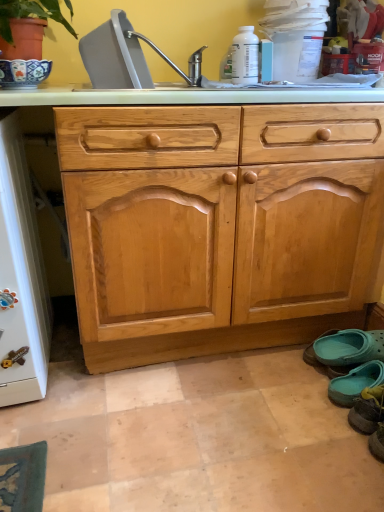
Question: Which direction should I rotate to look at gray plastic sink at upper center, placed as the 2th sink when sorted from back to front, — up or down?

Choices:
 (A) down
 (B) up

Answer: (B)

Question: Can you confirm if white glossy refrigerator at left is smaller than teal fabric slipper at lower right, which is counted as the second footwear, starting from the back?

Choices:
 (A) no
 (B) yes

Answer: (A)

Question: From a real-world perspective, is white glossy refrigerator at left located beneath teal fabric slipper at lower right, the second footwear when ordered from front to back?

Choices:
 (A) yes
 (B) no

Answer: (B)

Question: Does white glossy refrigerator at left have a lesser width compared to teal fabric slipper at lower right, the second footwear when ordered from front to back?

Choices:
 (A) no
 (B) yes

Answer: (A)

Question: Is teal fabric slipper at lower right, the second footwear when ordered from front to back, at the back of white glossy refrigerator at left?

Choices:
 (A) no
 (B) yes

Answer: (A)

Question: Does white glossy refrigerator at left appear on the left side of teal fabric slipper at lower right, which is counted as the second footwear, starting from the back?

Choices:
 (A) no
 (B) yes

Answer: (B)

Question: Is white glossy refrigerator at left taller than teal fabric slipper at lower right, which is counted as the second footwear, starting from the back?

Choices:
 (A) yes
 (B) no

Answer: (A)

Question: Could you tell me if teal fabric slipper at lower right, the second footwear when ordered from front to back, is turned towards teal rubber clogs at lower right, acting as the 1th footwear starting from the back?

Choices:
 (A) yes
 (B) no

Answer: (B)

Question: Is the depth of teal fabric slipper at lower right, the second footwear when ordered from front to back, less than that of teal rubber clogs at lower right, acting as the 1th footwear starting from the back?

Choices:
 (A) no
 (B) yes

Answer: (B)

Question: From the image's perspective, is teal fabric slipper at lower right, the second footwear when ordered from front to back, below teal rubber clogs at lower right, acting as the 1th footwear starting from the back?

Choices:
 (A) yes
 (B) no

Answer: (A)

Question: Does teal fabric slipper at lower right, the second footwear when ordered from front to back, have a smaller size compared to teal rubber clogs at lower right, the third footwear from the front?

Choices:
 (A) no
 (B) yes

Answer: (A)

Question: From a real-world perspective, is teal fabric slipper at lower right, the second footwear when ordered from front to back, on top of teal rubber clogs at lower right, the third footwear from the front?

Choices:
 (A) no
 (B) yes

Answer: (B)

Question: Can you confirm if teal fabric slipper at lower right, which is counted as the second footwear, starting from the back, is bigger than teal rubber clogs at lower right, acting as the 1th footwear starting from the back?

Choices:
 (A) yes
 (B) no

Answer: (A)

Question: Does teal fabric slipper at lower right, arranged as the first footwear when viewed from the front, touch teal fabric slipper at lower right, the second footwear when ordered from front to back?

Choices:
 (A) yes
 (B) no

Answer: (A)